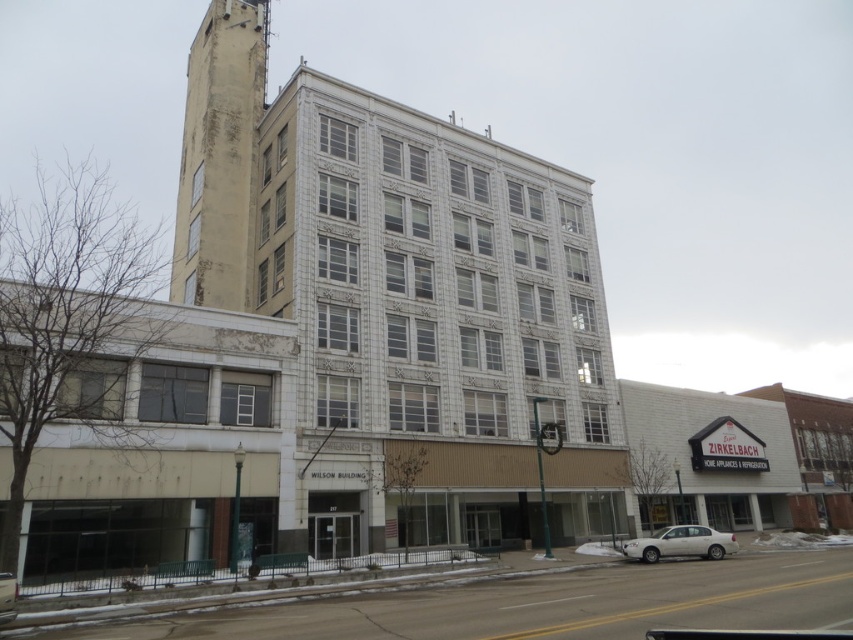
Between white matte sedan at lower center and silver metallic sedan at lower left, which one is positioned lower?

white matte sedan at lower center is below.

Measure the distance between white matte sedan at lower center and camera.

33.19 meters

Between point (727, 545) and point (4, 579), which one is positioned in front?

Point (4, 579) is more forward.

The image size is (853, 640). What are the coordinates of `white matte sedan at lower center` in the screenshot? It's located at (682, 544).

Which is behind, point (219, 288) or point (12, 612)?

The point (219, 288) is behind.

Identify the location of yellowish concrete bell tower at upper left. (219, 156).

Does yellowish concrete bell tower at upper left appear on the left side of white matte sedan at lower center?

Correct, you'll find yellowish concrete bell tower at upper left to the left of white matte sedan at lower center.

Is yellowish concrete bell tower at upper left taller than white matte sedan at lower center?

Yes, yellowish concrete bell tower at upper left is taller than white matte sedan at lower center.

This screenshot has width=853, height=640. What do you see at coordinates (219, 156) in the screenshot? I see `yellowish concrete bell tower at upper left` at bounding box center [219, 156].

Locate an element on the screen. This screenshot has height=640, width=853. yellowish concrete bell tower at upper left is located at coordinates (219, 156).